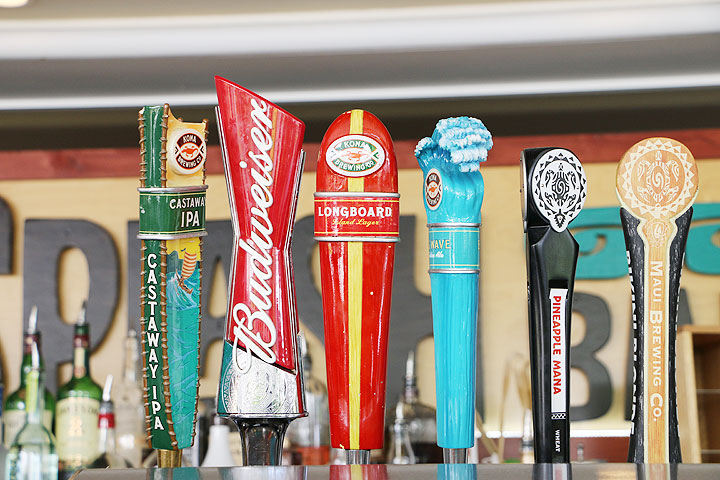
Find the location of a particular element. Image resolution: width=720 pixels, height=480 pixels. bottle is located at coordinates (14, 412), (35, 444), (76, 416), (102, 444), (129, 409), (397, 444), (320, 444).